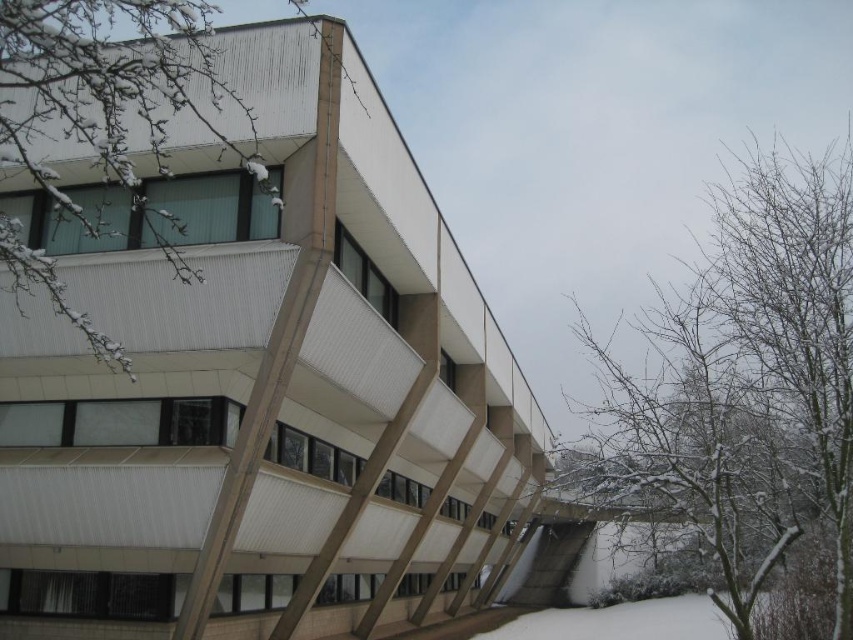
You are standing at the base of the modern architectural structure described. Looking up, you notice a point marked at coordinates (746, 388) on the building. What object is located at this specific coordinate?

At point (746, 388) lies snow covered branches at upper right.